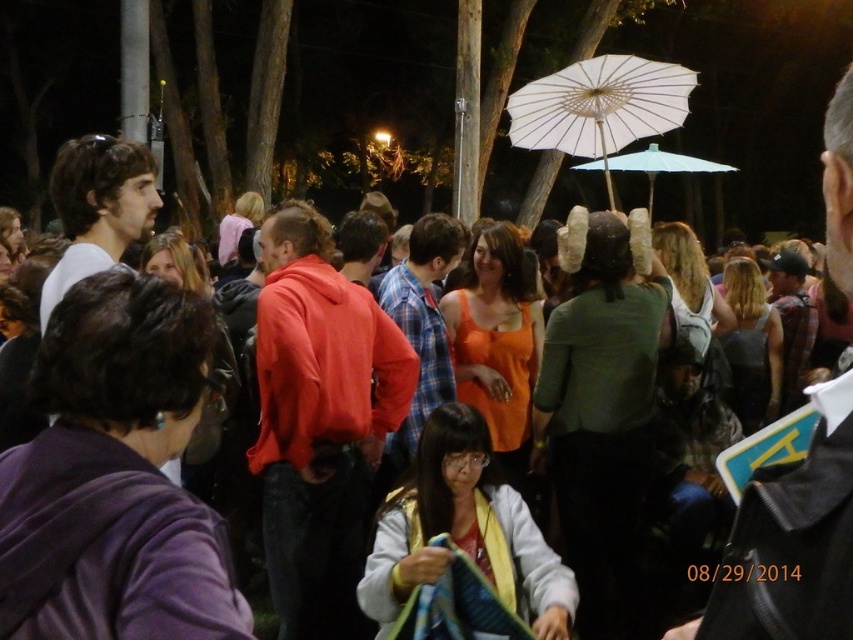
Question: Which point is farther to the camera?

Choices:
 (A) plaid fabric shirt at center
 (B) white paper umbrella at upper center

Answer: (B)

Question: Can you confirm if matte black jacket at center is thinner than white paper umbrella at upper center?

Choices:
 (A) yes
 (B) no

Answer: (A)

Question: Among these objects, which one is farthest from the camera?

Choices:
 (A) white paper umbrella at upper center
 (B) matte black jacket at center
 (C) matte white hair at upper left
 (D) matte red hoodie at center

Answer: (A)

Question: Does white paper umbrella at upper center have a lesser width compared to plaid fabric shirt at center?

Choices:
 (A) no
 (B) yes

Answer: (A)

Question: Among these objects, which one is nearest to the camera?

Choices:
 (A) matte white hair at upper left
 (B) matte black jacket at center

Answer: (B)

Question: Can you confirm if matte black jacket at center is thinner than matte white hair at upper left?

Choices:
 (A) yes
 (B) no

Answer: (A)